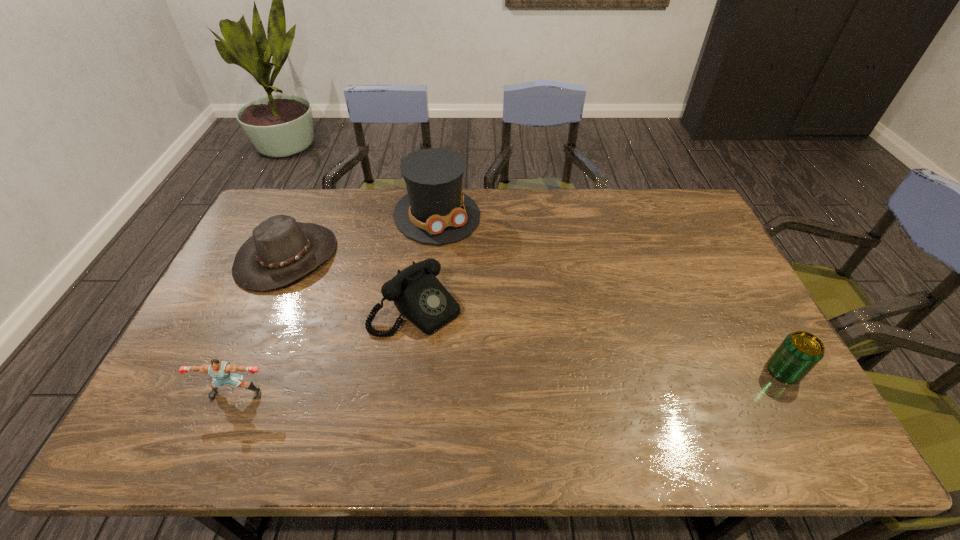
Where is `free spot between the beer can and the hat`? The width and height of the screenshot is (960, 540). free spot between the beer can and the hat is located at coordinates (535, 314).

In order to click on blank region between the telephone and the hat in this screenshot , I will do `click(351, 282)`.

This screenshot has width=960, height=540. Identify the location of vacant area that lies between the rightmost object and the hat. (535, 314).

At what (x,y) coordinates should I click in order to perform the action: click on vacant space that's between the puncher and the telephone. Please return your answer as a coordinate pair (x, y). The width and height of the screenshot is (960, 540). Looking at the image, I should click on (326, 350).

Where is `free spot between the telephone and the hat`? This screenshot has height=540, width=960. free spot between the telephone and the hat is located at coordinates (351, 282).

This screenshot has height=540, width=960. Identify the location of free area in between the hat and the beer can. (535, 314).

Identify the location of free space between the dress hat and the rightmost object. Image resolution: width=960 pixels, height=540 pixels. (610, 293).

Identify the location of free spot between the telephone and the hat. (351, 282).

What are the coordinates of `object identified as the second closest to the puncher` in the screenshot? It's located at (281, 250).

Identify the location of object that ranks as the second closest to the rightmost object. (435, 211).